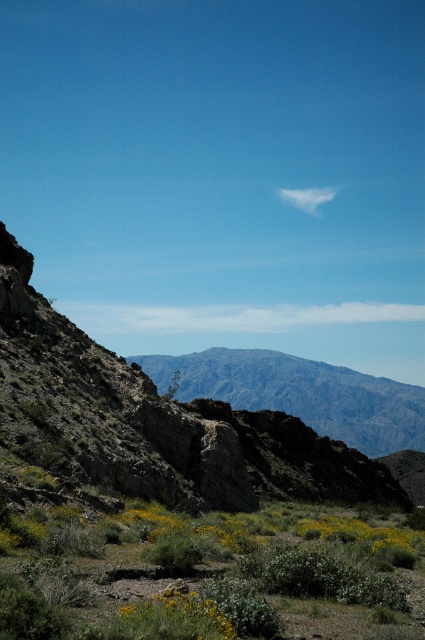
You are standing in the middle of the rugged, arid landscape shown in the image. You see a rocky at center and a gray rocky mountain at center. Which one is closer to you?

The rocky at center is closer to the viewer than the gray rocky mountain at center.

You are a hiker standing at the base of the rocky at center and want to reach the gray rocky mountain at center. Which direction should you head towards?

The rocky at center is to the left of the gray rocky mountain at center, so you should head to the right to reach it.

You are a hiker planning to traverse the rocky at center and the gray rocky mountain at center. Which terrain feature will you encounter first on your path?

The rocky at center will be encountered first because it occupies less space than the gray rocky mountain at center, indicating it is closer to the observer.